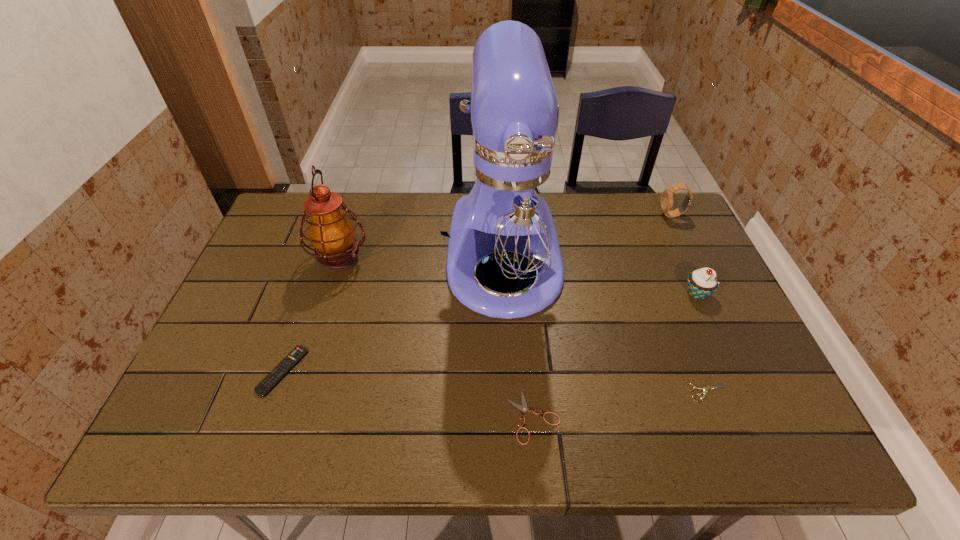
The width and height of the screenshot is (960, 540). In order to click on watch that is at the right edge in this screenshot , I will do click(x=667, y=196).

The height and width of the screenshot is (540, 960). What are the coordinates of `cupcake that is at the right edge` in the screenshot? It's located at (701, 283).

The width and height of the screenshot is (960, 540). What are the coordinates of `shears located in the right edge section of the desktop` in the screenshot? It's located at (706, 388).

At what (x,y) coordinates should I click in order to perform the action: click on object that is at the far right corner. Please return your answer as a coordinate pair (x, y). Image resolution: width=960 pixels, height=540 pixels. Looking at the image, I should click on (667, 196).

The height and width of the screenshot is (540, 960). In order to click on free region at the far edge of the desktop in this screenshot , I will do `click(621, 206)`.

You are a GUI agent. You are given a task and a screenshot of the screen. Output one action in this format:
    pyautogui.click(x=<x>, y=<y>)
    Task: Click on the vacant space at the near edge
    This screenshot has height=540, width=960.
    Given the screenshot: What is the action you would take?
    pyautogui.click(x=636, y=437)

You are a GUI agent. You are given a task and a screenshot of the screen. Output one action in this format:
    pyautogui.click(x=<x>, y=<y>)
    Task: Click on the free spot at the left edge of the desktop
    
    Given the screenshot: What is the action you would take?
    pyautogui.click(x=299, y=259)

Where is `free space at the right edge of the desktop`? free space at the right edge of the desktop is located at coordinates (723, 310).

Identify the location of free space at the near right corner of the desktop. Image resolution: width=960 pixels, height=540 pixels. (798, 448).

Identify the location of vacant space that's between the watch and the left shears. (603, 316).